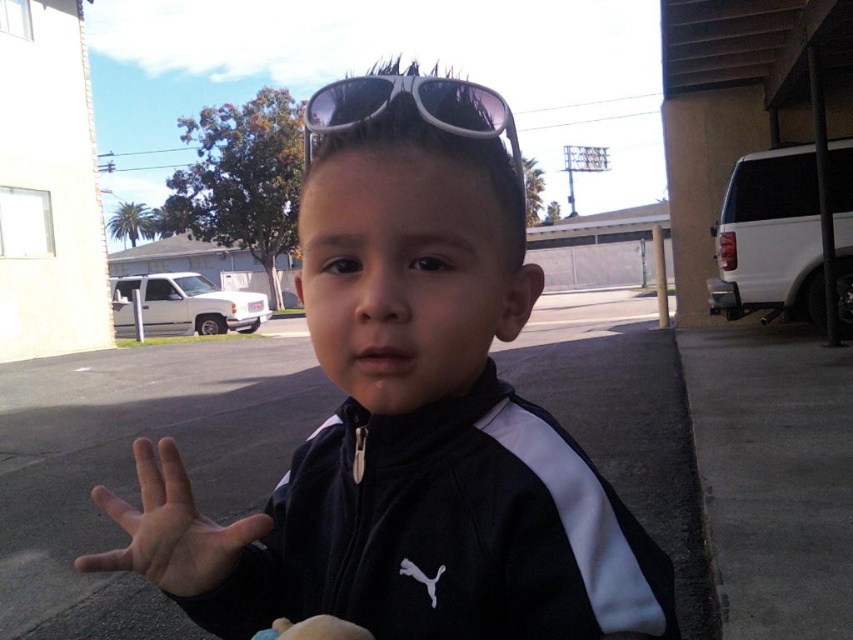
Question: Which point is farther to the camera?

Choices:
 (A) smooth skin hand at center
 (B) white matte hand at center
 (C) black matte jacket at center
 (D) sunglasses at center

Answer: (A)

Question: Which point is closer to the camera?

Choices:
 (A) sunglasses at center
 (B) smooth skin hand at center
 (C) black matte jacket at center
 (D) white matte hand at center

Answer: (D)

Question: Is black matte jacket at center behind smooth skin hand at center?

Choices:
 (A) no
 (B) yes

Answer: (A)

Question: Does black matte jacket at center have a greater width compared to sunglasses at center?

Choices:
 (A) no
 (B) yes

Answer: (B)

Question: Is smooth skin hand at center positioned at the back of white matte hand at center?

Choices:
 (A) no
 (B) yes

Answer: (B)

Question: Which point is farther to the camera?

Choices:
 (A) (349, 220)
 (B) (325, 636)
 (C) (122, 554)
 (D) (345, 102)

Answer: (C)